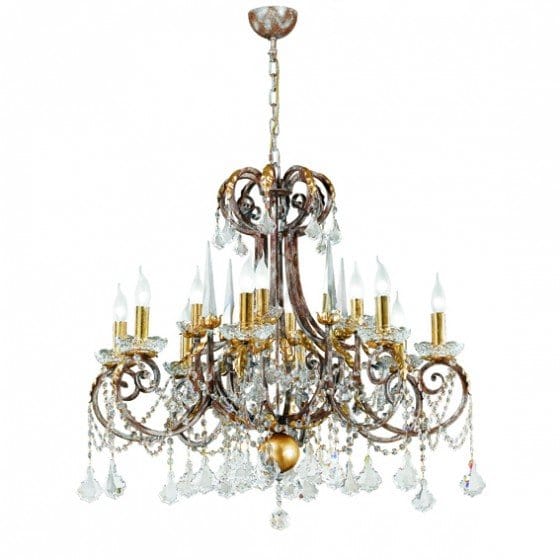
This screenshot has height=560, width=560. What are the coordinates of `crystal dish` in the screenshot? It's located at (160, 340), (105, 356), (252, 330), (182, 366), (379, 340), (452, 352), (387, 366), (364, 316).